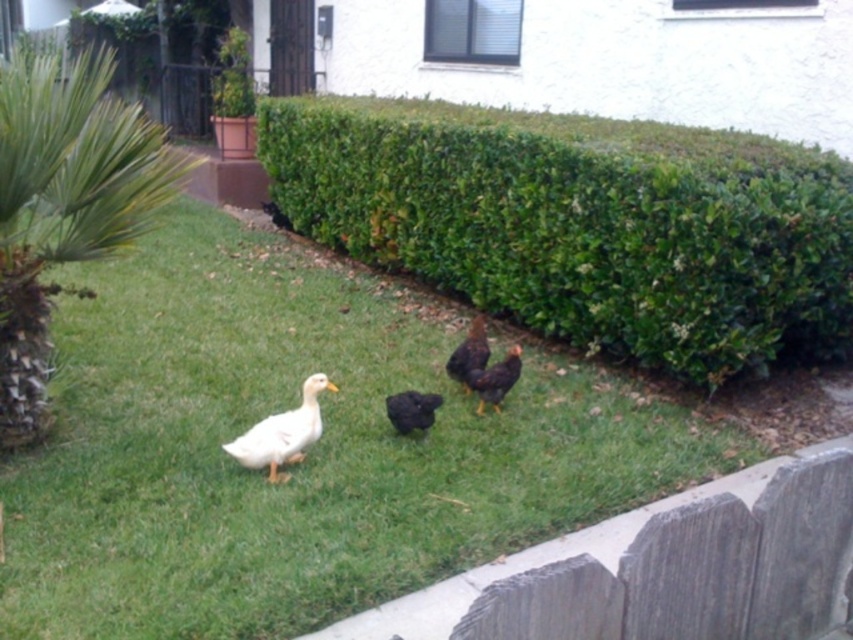
Can you confirm if green leafy palm tree at left is thinner than white matte duck at center?

Indeed, green leafy palm tree at left has a lesser width compared to white matte duck at center.

Between point (38, 193) and point (508, 371), which one is positioned behind?

Point (508, 371)

Which is in front, point (49, 138) or point (491, 372)?

Positioned in front is point (49, 138).

At what (x,y) coordinates should I click in order to perform the action: click on green leafy palm tree at left. Please return your answer as a coordinate pair (x, y). The height and width of the screenshot is (640, 853). Looking at the image, I should click on (65, 204).

Consider the image. Can you confirm if green grass at center is wider than green leafy hedge at upper center?

Incorrect, green grass at center's width does not surpass green leafy hedge at upper center's.

The image size is (853, 640). Identify the location of green grass at center. (308, 452).

Is gray wood fence at lower right thinner than white matte duck at lower left?

In fact, gray wood fence at lower right might be wider than white matte duck at lower left.

Does gray wood fence at lower right have a larger size compared to white matte duck at lower left?

Yes, gray wood fence at lower right is bigger than white matte duck at lower left.

Locate an element on the screen. The width and height of the screenshot is (853, 640). gray wood fence at lower right is located at coordinates (697, 570).

The image size is (853, 640). I want to click on gray wood fence at lower right, so click(697, 570).